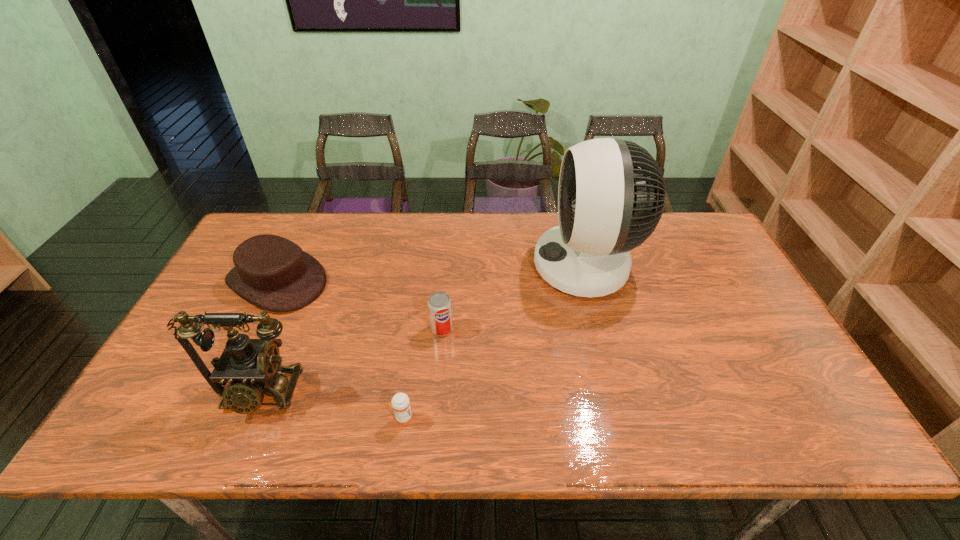
At what (x,y) coordinates should I click in order to perform the action: click on free point between the shortest object and the telephone. Please return your answer as a coordinate pair (x, y). The width and height of the screenshot is (960, 540). Looking at the image, I should click on (331, 406).

Locate an element on the screen. free space between the soda and the rightmost object is located at coordinates (514, 298).

I want to click on blank region between the fan and the shortest object, so click(494, 342).

At what (x,y) coordinates should I click in order to perform the action: click on free spot between the third farthest object and the third object from right to left. Please return your answer as a coordinate pair (x, y). The width and height of the screenshot is (960, 540). Looking at the image, I should click on (422, 374).

Locate an element on the screen. The width and height of the screenshot is (960, 540). blank region between the fan and the second object from right to left is located at coordinates (514, 298).

Identify the location of vacant space that's between the hat and the medicine. (340, 350).

Locate which object ranks fourth in proximity to the hat. Please provide its 2D coordinates. Your answer should be formatted as a tuple, i.e. [(x, y)], where the tuple contains the x and y coordinates of a point satisfying the conditions above.

[(611, 195)]

Where is `object that stands as the fourth closest to the fan`? The height and width of the screenshot is (540, 960). object that stands as the fourth closest to the fan is located at coordinates point(272,272).

This screenshot has width=960, height=540. Identify the location of free space that satisfies the following two spatial constraints: 1. on the grille of the tallest object; 2. on the rotary dial of the telephone. (619, 393).